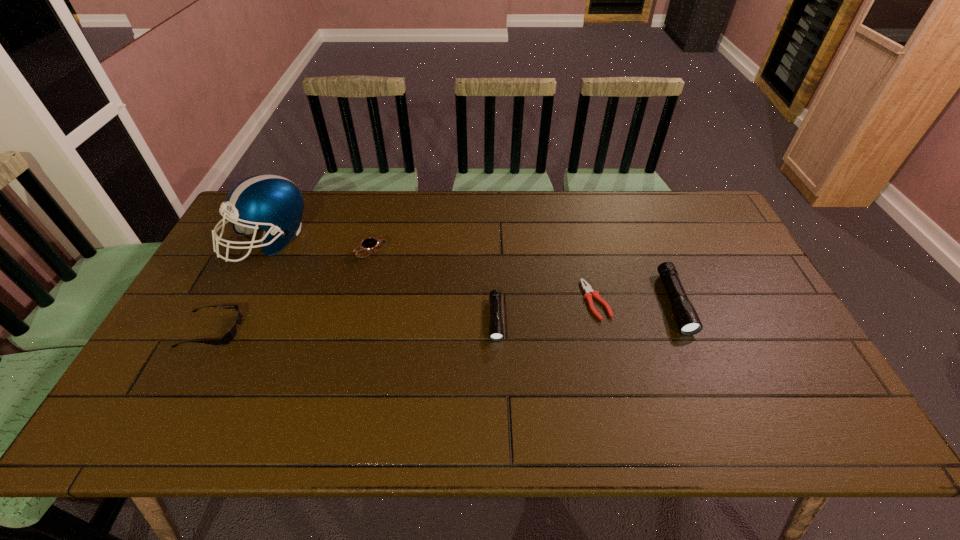
Where is `the fourth object from left to right`? the fourth object from left to right is located at coordinates point(496,331).

Find the location of a particular element. the shorter flashlight is located at coordinates (496, 331).

The image size is (960, 540). I want to click on the taller flashlight, so click(x=688, y=322).

At what (x,y) coordinates should I click in order to perform the action: click on the second tallest object. Please return your answer as a coordinate pair (x, y). The height and width of the screenshot is (540, 960). Looking at the image, I should click on (688, 322).

Where is `the tallest object`? This screenshot has height=540, width=960. the tallest object is located at coordinates click(x=271, y=202).

You are a GUI agent. You are given a task and a screenshot of the screen. Output one action in this format:
    pyautogui.click(x=<x>, y=<y>)
    Task: Click on the third object from left to right
    Image resolution: width=960 pixels, height=540 pixels.
    Given the screenshot: What is the action you would take?
    pyautogui.click(x=371, y=244)

Where is `pliers`? The height and width of the screenshot is (540, 960). pliers is located at coordinates (589, 292).

The image size is (960, 540). I want to click on the shortest object, so click(x=589, y=292).

Where is `sunglasses`? sunglasses is located at coordinates (230, 335).

Image resolution: width=960 pixels, height=540 pixels. In order to click on vacant space situated 0.050m at the lens end of the fourth object from left to right in this screenshot , I will do `click(497, 358)`.